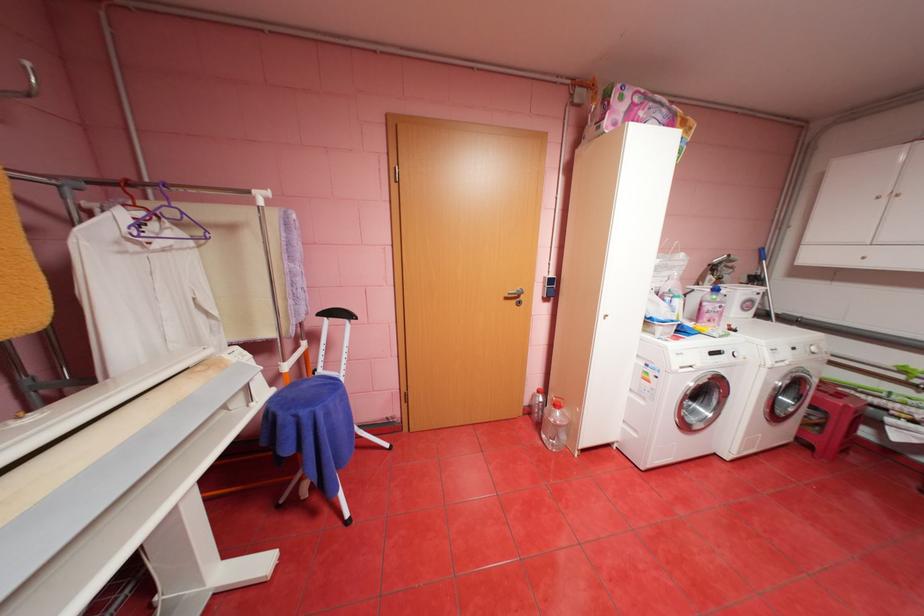
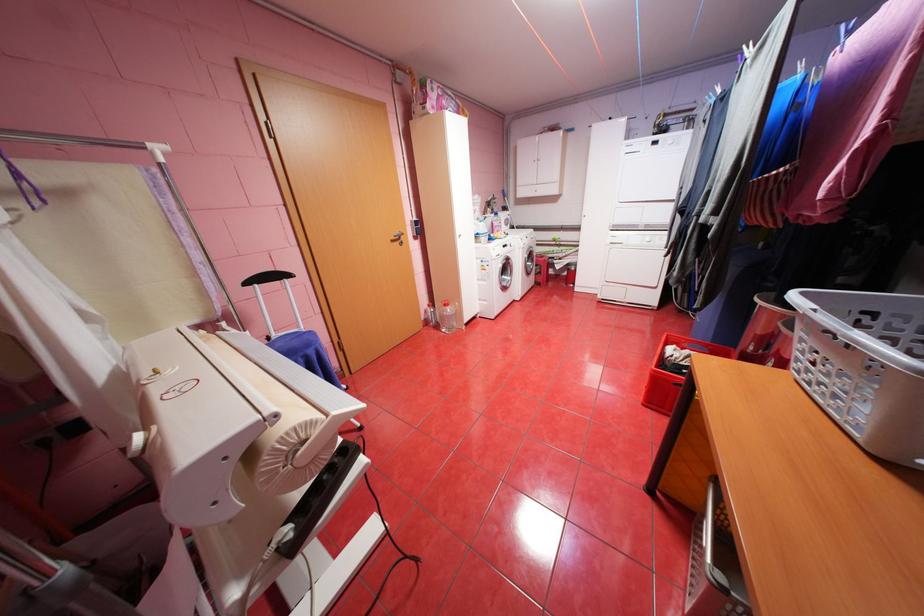
Locate, in the second image, the point that corresponds to (643,435) in the first image.

(494, 302)